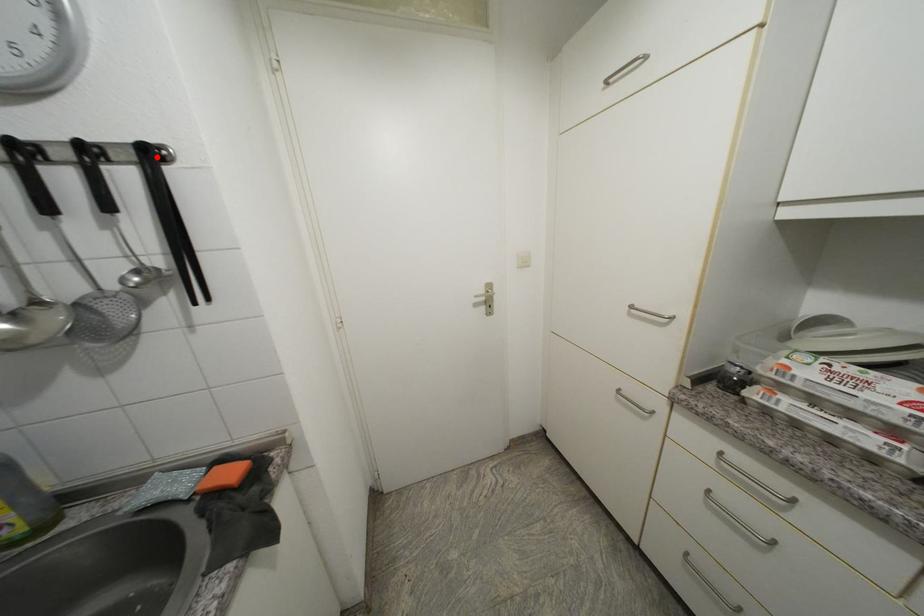
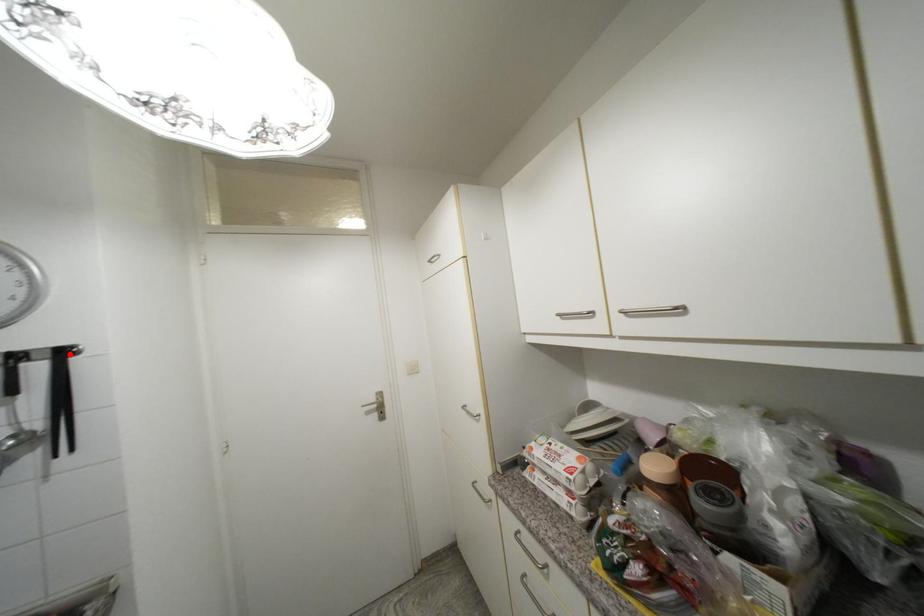
In the scene shown: I am providing you with two images of the same scene from different viewpoints. A red point is marked on the first image and another point is marked on the second image. Is the marked point in image1 the same physical position as the marked point in image2?

Yes